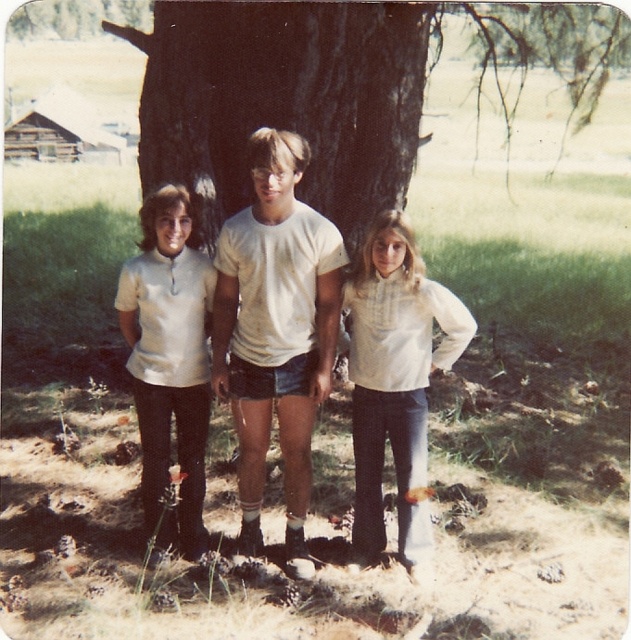
Locate an element on the screen. The image size is (631, 640). white cotton t-shirt at center is located at coordinates (274, 332).

Does white cotton t-shirt at center have a larger size compared to matte white shirt at center?

Correct, white cotton t-shirt at center is larger in size than matte white shirt at center.

Is point (271, 257) farther from camera compared to point (155, 204)?

No, (271, 257) is in front of (155, 204).

The width and height of the screenshot is (631, 640). I want to click on white cotton t-shirt at center, so click(274, 332).

Is point (293, 285) in front of point (425, 362)?

Yes.

Does point (305, 392) come behind point (369, 310)?

No.

Find the location of a particular element. This screenshot has width=631, height=640. white cotton t-shirt at center is located at coordinates (274, 332).

This screenshot has height=640, width=631. What do you see at coordinates (396, 380) in the screenshot?
I see `white cotton shirt at center` at bounding box center [396, 380].

Who is more forward, (396, 417) or (139, 292)?

Positioned in front is point (396, 417).

Between point (415, 557) and point (174, 333), which one is positioned in front?

Point (174, 333) is in front.

Identify the location of white cotton shirt at center. (396, 380).